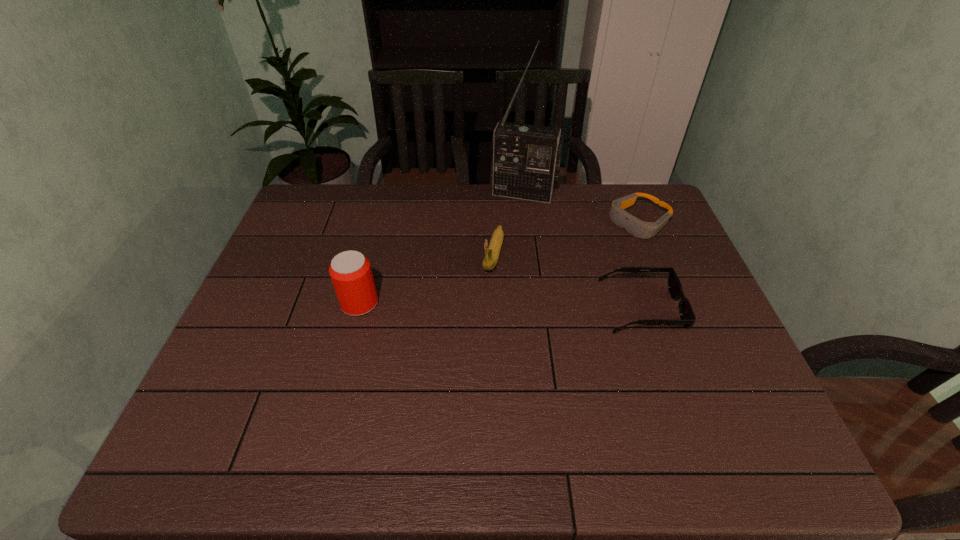
Image resolution: width=960 pixels, height=540 pixels. Find the location of `free spot that satisfies the following two spatial constraints: 1. on the back side of the farthest object; 2. on the left side of the second tallest object`. free spot that satisfies the following two spatial constraints: 1. on the back side of the farthest object; 2. on the left side of the second tallest object is located at coordinates [388, 194].

Where is `free spot that satisfies the following two spatial constraints: 1. on the front side of the tallest object; 2. at the front lenses of the sunglasses`? free spot that satisfies the following two spatial constraints: 1. on the front side of the tallest object; 2. at the front lenses of the sunglasses is located at coordinates (538, 308).

Where is `vacant region that satisfies the following two spatial constraints: 1. on the back side of the goggles; 2. on the right side of the second tallest object`? The image size is (960, 540). vacant region that satisfies the following two spatial constraints: 1. on the back side of the goggles; 2. on the right side of the second tallest object is located at coordinates (381, 222).